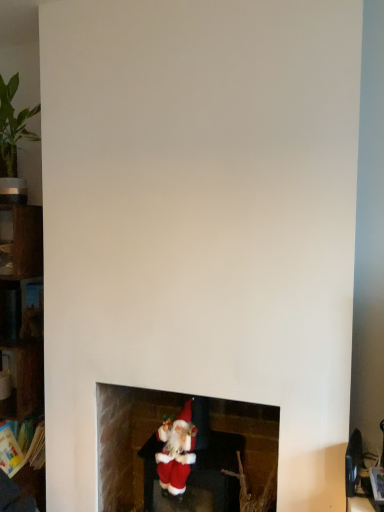
This screenshot has width=384, height=512. What do you see at coordinates (250, 493) in the screenshot?
I see `green matte plant at lower center` at bounding box center [250, 493].

Find the location of a particular element. This screenshot has height=512, width=384. wooden shelf at left, positioned as the second shelf in top-to-bottom order is located at coordinates (22, 316).

This screenshot has height=512, width=384. Describe the element at coordinates (188, 453) in the screenshot. I see `red plush santa at lower center` at that location.

What do you see at coordinates (21, 309) in the screenshot? I see `metallic dark gray shelf at left, the second shelf positioned from the bottom` at bounding box center [21, 309].

This screenshot has height=512, width=384. I want to click on green matte plant at lower center, so click(250, 493).

Can you confirm if velvet santa at lower center is bigger than metallic dark gray shelf at left, the 1th shelf in the top-to-bottom sequence?

Correct, velvet santa at lower center is larger in size than metallic dark gray shelf at left, the 1th shelf in the top-to-bottom sequence.

Between velvet santa at lower center and metallic dark gray shelf at left, the 1th shelf in the top-to-bottom sequence, which one appears on the right side from the viewer's perspective?

velvet santa at lower center is more to the right.

Where is `the 2nd shelf positioned above the velvet santa at lower center (from the image's perspective)`? This screenshot has width=384, height=512. the 2nd shelf positioned above the velvet santa at lower center (from the image's perspective) is located at coordinates (21, 309).

Does velvet santa at lower center touch metallic dark gray shelf at left, the second shelf positioned from the bottom?

No, velvet santa at lower center is not touching metallic dark gray shelf at left, the second shelf positioned from the bottom.

From the image's perspective, between velvet santa at lower center and wooden shelf at left, the 1th shelf from the bottom, which one is located above?

wooden shelf at left, the 1th shelf from the bottom, from the image's perspective.

Considering the sizes of objects velvet santa at lower center and wooden shelf at left, the 1th shelf from the bottom, in the image provided, who is thinner, velvet santa at lower center or wooden shelf at left, the 1th shelf from the bottom,?

With smaller width is velvet santa at lower center.

Is there a large distance between velvet santa at lower center and wooden shelf at left, the 1th shelf from the bottom?

Actually, velvet santa at lower center and wooden shelf at left, the 1th shelf from the bottom, are a little close together.

From a real-world perspective, which shelf is the 1st one above the velvet santa at lower center? Please provide its 2D coordinates.

[(22, 316)]

From the image's perspective, is wooden shelf at left, positioned as the second shelf in top-to-bottom order, above or below metallic dark gray shelf at left, the 1th shelf in the top-to-bottom sequence?

Based on their image positions, wooden shelf at left, positioned as the second shelf in top-to-bottom order, is located beneath metallic dark gray shelf at left, the 1th shelf in the top-to-bottom sequence.

Is wooden shelf at left, the 1th shelf from the bottom, positioned with its back to metallic dark gray shelf at left, the 1th shelf in the top-to-bottom sequence?

Correct, wooden shelf at left, the 1th shelf from the bottom, is looking away from metallic dark gray shelf at left, the 1th shelf in the top-to-bottom sequence.

Which is in front, wooden shelf at left, positioned as the second shelf in top-to-bottom order, or metallic dark gray shelf at left, the second shelf positioned from the bottom?

Positioned in front is wooden shelf at left, positioned as the second shelf in top-to-bottom order.

Is wooden shelf at left, positioned as the second shelf in top-to-bottom order, in contact with metallic dark gray shelf at left, the 1th shelf in the top-to-bottom sequence?

Yes.

In the scene shown: Can you confirm if green matte plant at lower center is positioned to the left of red plush santa at lower center?

Incorrect, green matte plant at lower center is not on the left side of red plush santa at lower center.

From the image's perspective, is green matte plant at lower center below red plush santa at lower center?

Yes, from the image's perspective, green matte plant at lower center is beneath red plush santa at lower center.

Does green matte plant at lower center have a smaller size compared to red plush santa at lower center?

Yes, green matte plant at lower center is smaller than red plush santa at lower center.

Is green matte plant at lower center positioned beyond the bounds of red plush santa at lower center?

Yes, green matte plant at lower center is located beyond the bounds of red plush santa at lower center.

What's the angular difference between metallic dark gray shelf at left, the 1th shelf in the top-to-bottom sequence, and green matte plant at lower center's facing directions?

The angle between the facing direction of metallic dark gray shelf at left, the 1th shelf in the top-to-bottom sequence, and the facing direction of green matte plant at lower center is 1.57 degrees.

Could you measure the distance between metallic dark gray shelf at left, the 1th shelf in the top-to-bottom sequence, and green matte plant at lower center?

A distance of 3.96 feet exists between metallic dark gray shelf at left, the 1th shelf in the top-to-bottom sequence, and green matte plant at lower center.

Based on the photo, is metallic dark gray shelf at left, the 1th shelf in the top-to-bottom sequence, bigger than green matte plant at lower center?

Incorrect, metallic dark gray shelf at left, the 1th shelf in the top-to-bottom sequence, is not larger than green matte plant at lower center.

From a real-world perspective, which object rests below the other?

From a 3D spatial view, green matte plant at lower center is below.

Who is smaller, green matte plant at lower center or wooden shelf at left, the 1th shelf from the bottom?

green matte plant at lower center.

Can you confirm if green matte plant at lower center is positioned to the left of wooden shelf at left, positioned as the second shelf in top-to-bottom order?

No, green matte plant at lower center is not to the left of wooden shelf at left, positioned as the second shelf in top-to-bottom order.

Is wooden shelf at left, the 1th shelf from the bottom, at the back of green matte plant at lower center?

That's not correct — green matte plant at lower center is not looking away from wooden shelf at left, the 1th shelf from the bottom.

Is green matte plant at lower center touching wooden shelf at left, the 1th shelf from the bottom?

No, green matte plant at lower center is not touching wooden shelf at left, the 1th shelf from the bottom.

Is green matte plant at lower center to the left or to the right of metallic dark gray shelf at left, the 1th shelf in the top-to-bottom sequence, in the image?

green matte plant at lower center is to the right of metallic dark gray shelf at left, the 1th shelf in the top-to-bottom sequence.

Would you say green matte plant at lower center is a long distance from metallic dark gray shelf at left, the second shelf positioned from the bottom?

Yes.

Looking at their sizes, would you say green matte plant at lower center is wider or thinner than metallic dark gray shelf at left, the 1th shelf in the top-to-bottom sequence?

green matte plant at lower center is wider than metallic dark gray shelf at left, the 1th shelf in the top-to-bottom sequence.

From the image's perspective, which is below, green matte plant at lower center or metallic dark gray shelf at left, the 1th shelf in the top-to-bottom sequence?

green matte plant at lower center, from the image's perspective.

There is a velvet santa at lower center. At what (x,y) coordinates should I click in order to perform the action: click on the 2nd shelf above it (from the image's perspective). Please return your answer as a coordinate pair (x, y). Looking at the image, I should click on (21, 309).

This screenshot has width=384, height=512. Identify the location of shelf that is the 2nd one when counting leftward from the velvet santa at lower center. (22, 316).

Which object lies further to the anchor point metallic dark gray shelf at left, the 1th shelf in the top-to-bottom sequence, red plush santa at lower center or wooden shelf at left, positioned as the second shelf in top-to-bottom order?

The object further to metallic dark gray shelf at left, the 1th shelf in the top-to-bottom sequence, is red plush santa at lower center.

Considering their positions, is metallic dark gray shelf at left, the second shelf positioned from the bottom, positioned closer to green matte plant at lower center than velvet santa at lower center?

velvet santa at lower center is closer to green matte plant at lower center.

Based on their spatial positions, is velvet santa at lower center or wooden shelf at left, positioned as the second shelf in top-to-bottom order, closer to metallic dark gray shelf at left, the second shelf positioned from the bottom?

wooden shelf at left, positioned as the second shelf in top-to-bottom order, is positioned closer to the anchor metallic dark gray shelf at left, the second shelf positioned from the bottom.

Considering their positions, is green matte plant at lower center positioned closer to wooden shelf at left, the 1th shelf from the bottom, than red plush santa at lower center?

Among the two, red plush santa at lower center is located nearer to wooden shelf at left, the 1th shelf from the bottom.

Estimate the real-world distances between objects in this image. Which object is further from metallic dark gray shelf at left, the 1th shelf in the top-to-bottom sequence, wooden shelf at left, positioned as the second shelf in top-to-bottom order, or green matte plant at lower center?

Among the two, green matte plant at lower center is located further to metallic dark gray shelf at left, the 1th shelf in the top-to-bottom sequence.

In the scene shown: Based on their spatial positions, is metallic dark gray shelf at left, the second shelf positioned from the bottom, or velvet santa at lower center closer to wooden shelf at left, the 1th shelf from the bottom?

metallic dark gray shelf at left, the second shelf positioned from the bottom, lies closer to wooden shelf at left, the 1th shelf from the bottom, than the other object.

Looking at the image, which one is located closer to green matte plant at lower center, wooden shelf at left, positioned as the second shelf in top-to-bottom order, or red plush santa at lower center?

Among the two, red plush santa at lower center is located nearer to green matte plant at lower center.

From the image, which object appears to be nearer to green matte plant at lower center, wooden shelf at left, the 1th shelf from the bottom, or velvet santa at lower center?

Based on the image, velvet santa at lower center appears to be nearer to green matte plant at lower center.

The height and width of the screenshot is (512, 384). Find the location of `fireplace between metallic dark gray shelf at left, the 1th shelf in the top-to-bottom sequence, and green matte plant at lower center from left to right`. fireplace between metallic dark gray shelf at left, the 1th shelf in the top-to-bottom sequence, and green matte plant at lower center from left to right is located at coordinates (188, 453).

At what (x,y) coordinates should I click in order to perform the action: click on shelf between wooden shelf at left, the 1th shelf from the bottom, and red plush santa at lower center from left to right. Please return your answer as a coordinate pair (x, y). The width and height of the screenshot is (384, 512). Looking at the image, I should click on (21, 309).

Locate an element on the screen. This screenshot has width=384, height=512. shelf between wooden shelf at left, the 1th shelf from the bottom, and green matte plant at lower center from left to right is located at coordinates (21, 309).

The width and height of the screenshot is (384, 512). What are the coordinates of `person between metallic dark gray shelf at left, the 1th shelf in the top-to-bottom sequence, and red plush santa at lower center from left to right` in the screenshot? It's located at (176, 452).